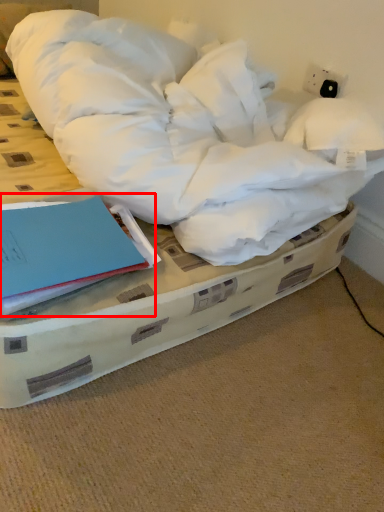
Question: From the image, what is the correct spatial relationship of paperback book (annotated by the red box) in relation to bed?

Choices:
 (A) left
 (B) right

Answer: (A)